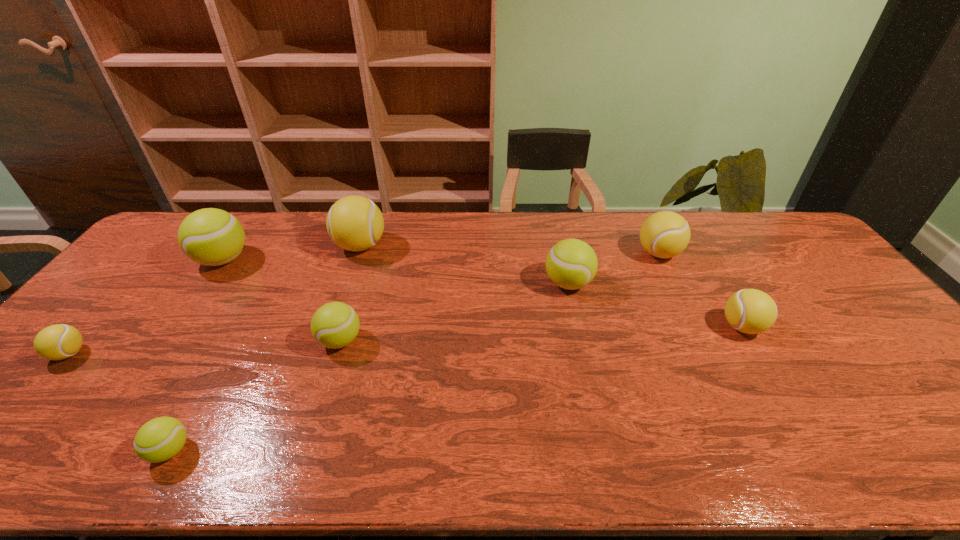
Locate which tennis ball ranks second in proximity to the third yellow tennis ball from right to left. Please provide its 2D coordinates. Your answer should be formatted as a tuple, i.e. [(x, y)], where the tuple contains the x and y coordinates of a point satisfying the conditions above.

[(334, 325)]

Image resolution: width=960 pixels, height=540 pixels. Find the location of `the second closest green tennis ball relative to the smallest green tennis ball`. the second closest green tennis ball relative to the smallest green tennis ball is located at coordinates (212, 237).

Find the location of a particular element. The width and height of the screenshot is (960, 540). green tennis ball that is the third nearest to the second smallest yellow tennis ball is located at coordinates (160, 439).

Locate an element on the screen. This screenshot has height=540, width=960. yellow tennis ball identified as the third closest to the smallest yellow tennis ball is located at coordinates (751, 311).

Locate which yellow tennis ball is the third closest to the smallest yellow tennis ball. Please provide its 2D coordinates. Your answer should be formatted as a tuple, i.e. [(x, y)], where the tuple contains the x and y coordinates of a point satisfying the conditions above.

[(751, 311)]

Identify the location of vacant region that satisfies the following two spatial constraints: 1. on the back side of the third yellow tennis ball from right to left; 2. on the left side of the second green tennis ball from left to right. (284, 246).